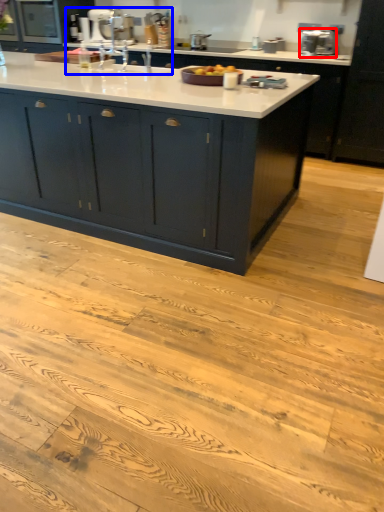
Question: Which point is closer to the camera, appliance (highlighted by a red box) or sink (highlighted by a blue box)?

Choices:
 (A) appliance
 (B) sink

Answer: (B)